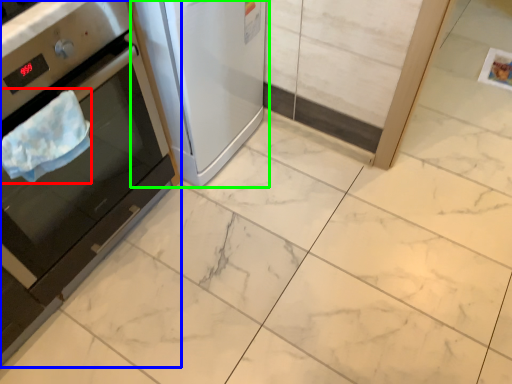
Question: Based on their relative distances, which object is farther from blanket (highlighted by a red box)? Choose from home appliance (highlighted by a blue box) and home appliance (highlighted by a green box).

Choices:
 (A) home appliance
 (B) home appliance

Answer: (B)